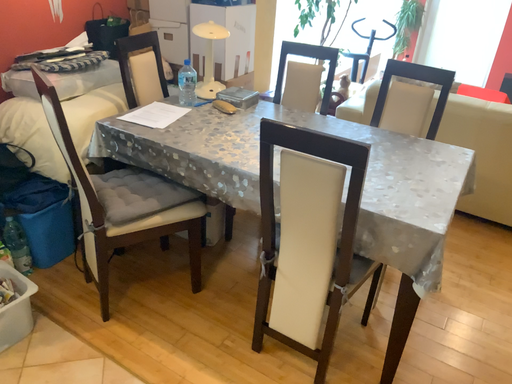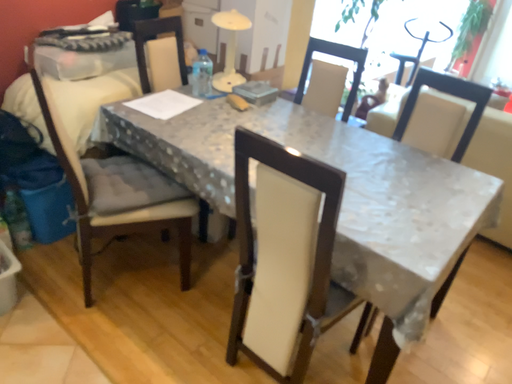
Question: How did the camera likely rotate when shooting the video?

Choices:
 (A) rotated right
 (B) rotated left

Answer: (B)